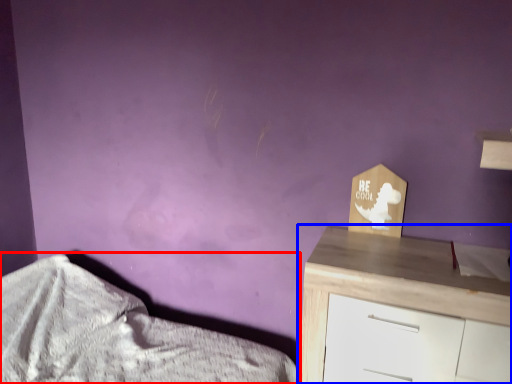
Question: Which of the following is the farthest to the observer, bed (highlighted by a red box) or chest of drawers (highlighted by a blue box)?

Choices:
 (A) bed
 (B) chest of drawers

Answer: (B)